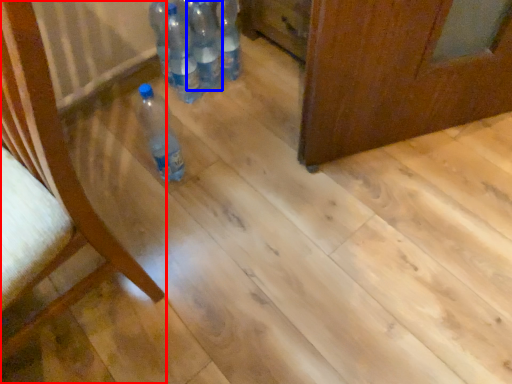
Question: Which object appears farthest to the camera in this image, furniture (highlighted by a red box) or bottle (highlighted by a blue box)?

Choices:
 (A) furniture
 (B) bottle

Answer: (B)